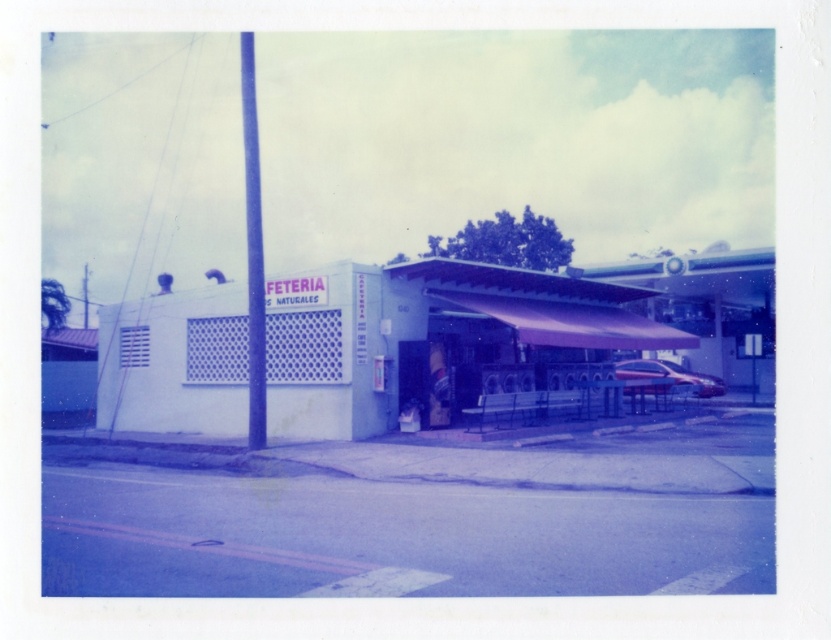
Can you confirm if smooth blue pole at center is wider than shiny silver car at center?

Yes, smooth blue pole at center is wider than shiny silver car at center.

Is smooth blue pole at center thinner than shiny silver car at center?

No, smooth blue pole at center is not thinner than shiny silver car at center.

Locate an element on the screen. The width and height of the screenshot is (831, 640). smooth blue pole at center is located at coordinates (253, 250).

Is point (387, 424) positioned in front of point (713, 390)?

Yes, it is.

Can you confirm if white lattice wall at center is wider than shiny silver car at center?

Yes.

Between point (362, 324) and point (661, 376), which one is positioned behind?

Positioned behind is point (661, 376).

What are the coordinates of `white lattice wall at center` in the screenshot? It's located at (420, 332).

Based on the photo, is white lattice wall at center wider than smooth blue pole at center?

A: Yes, white lattice wall at center is wider than smooth blue pole at center.

Which of these two, white lattice wall at center or smooth blue pole at center, stands taller?

smooth blue pole at center is taller.

Is point (311, 387) farther from viewer compared to point (261, 433)?

Yes, it is behind point (261, 433).

Image resolution: width=831 pixels, height=640 pixels. I want to click on white lattice wall at center, so click(x=420, y=332).